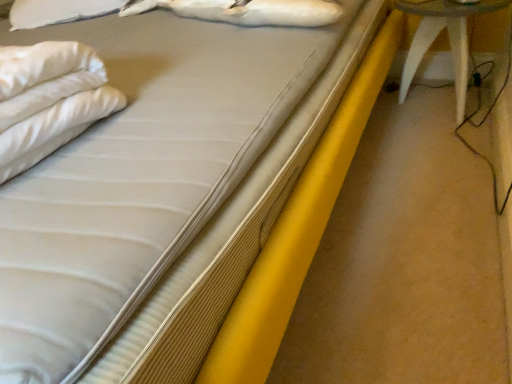
What do you see at coordinates (246, 11) in the screenshot? I see `white fur animal at upper center` at bounding box center [246, 11].

Where is `white fur animal at upper center`? The width and height of the screenshot is (512, 384). white fur animal at upper center is located at coordinates (246, 11).

The image size is (512, 384). What do you see at coordinates (449, 41) in the screenshot?
I see `white plastic stool at right` at bounding box center [449, 41].

Find the location of a particular element. white plastic stool at right is located at coordinates (449, 41).

Locate an element on the screen. white fur animal at upper center is located at coordinates (246, 11).

Looking at this image, which is more to the right, white plastic stool at right or white fur animal at upper center?

Positioned to the right is white plastic stool at right.

Which object is closer to the camera, white plastic stool at right or white fur animal at upper center?

white fur animal at upper center is in front.

Is point (428, 18) closer or farther from the camera than point (241, 12)?

Point (428, 18) is farther from the camera than point (241, 12).

From the image's perspective, is white plastic stool at right on white fur animal at upper center?

Actually, white plastic stool at right appears below white fur animal at upper center in the image.

From a real-world perspective, which is physically above, white plastic stool at right or white fur animal at upper center?

white fur animal at upper center.

Which object is thinner, white plastic stool at right or white fur animal at upper center?

white fur animal at upper center is thinner.

Considering the relative sizes of white plastic stool at right and white fur animal at upper center in the image provided, is white plastic stool at right shorter than white fur animal at upper center?

No.

Considering the sizes of objects white plastic stool at right and white fur animal at upper center in the image provided, who is bigger, white plastic stool at right or white fur animal at upper center?

Bigger between the two is white plastic stool at right.

Is white fur animal at upper center surrounded by white plastic stool at right?

That's incorrect, white fur animal at upper center is not inside white plastic stool at right.

Are white plastic stool at right and white fur animal at upper center located far from each other?

No, there isn't a large distance between white plastic stool at right and white fur animal at upper center.

Based on the photo, is white plastic stool at right looking in the opposite direction of white fur animal at upper center?

No, white plastic stool at right is not facing the opposite direction of white fur animal at upper center.

How many degrees apart are the facing directions of white plastic stool at right and white fur animal at upper center?

The angular difference between white plastic stool at right and white fur animal at upper center is 1.03 degrees.

You are a GUI agent. You are given a task and a screenshot of the screen. Output one action in this format:
    pyautogui.click(x=<x>, y=<y>)
    Task: Click on the animal that is above the white plastic stool at right (from a real-world perspective)
    
    Given the screenshot: What is the action you would take?
    tap(246, 11)

Which object is positioned more to the right, white fur animal at upper center or white plastic stool at right?

Positioned to the right is white plastic stool at right.

Considering the relative positions of white fur animal at upper center and white plastic stool at right in the image provided, is white fur animal at upper center in front of white plastic stool at right?

Yes, white fur animal at upper center is closer to the camera.

Between point (315, 21) and point (460, 60), which one is positioned behind?

The point (460, 60) is more distant.

From the image's perspective, between white fur animal at upper center and white plastic stool at right, which one is located above?

white fur animal at upper center, from the image's perspective.

From a real-world perspective, which is physically below, white fur animal at upper center or white plastic stool at right?

white plastic stool at right is physically lower.

Between white fur animal at upper center and white plastic stool at right, which one has smaller width?

With smaller width is white fur animal at upper center.

Who is shorter, white fur animal at upper center or white plastic stool at right?

white fur animal at upper center is shorter.

Looking at the image, does white fur animal at upper center seem bigger or smaller compared to white plastic stool at right?

Considering their sizes, white fur animal at upper center takes up less space than white plastic stool at right.

Would you say white fur animal at upper center is inside or outside white plastic stool at right?

white fur animal at upper center cannot be found inside white plastic stool at right.

In the scene shown: Is white fur animal at upper center placed right next to white plastic stool at right?

No, white fur animal at upper center is not making contact with white plastic stool at right.

Is white fur animal at upper center oriented towards white plastic stool at right?

No, white fur animal at upper center does not turn towards white plastic stool at right.

This screenshot has width=512, height=384. I want to click on animal in front of the white plastic stool at right, so click(246, 11).

The image size is (512, 384). In order to click on animal located above the white plastic stool at right (from a real-world perspective) in this screenshot , I will do `click(246, 11)`.

The height and width of the screenshot is (384, 512). I want to click on animal lying above the white plastic stool at right (from the image's perspective), so click(246, 11).